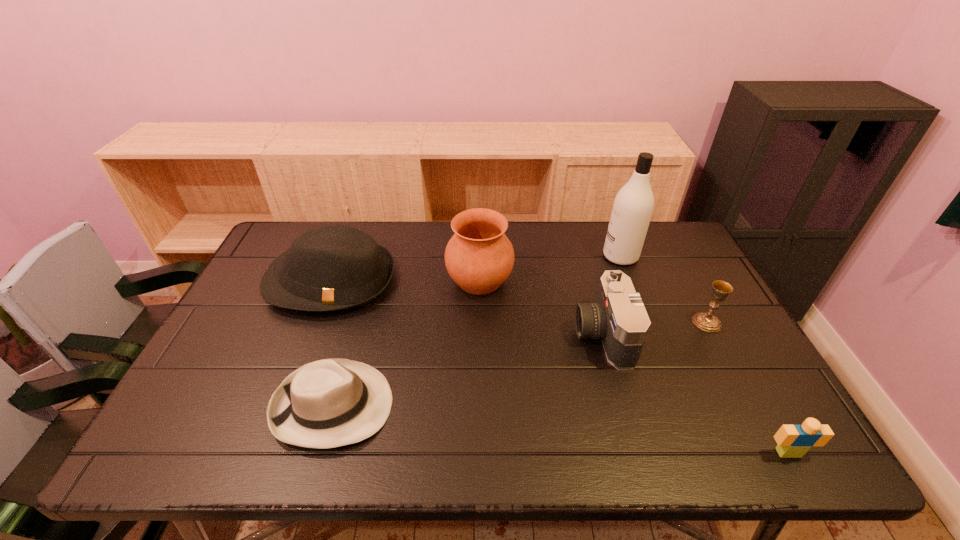
This screenshot has height=540, width=960. Find the location of `shampoo`. shampoo is located at coordinates (632, 209).

Image resolution: width=960 pixels, height=540 pixels. I want to click on the second tallest object, so click(479, 257).

Identify the location of pottery. This screenshot has width=960, height=540. (479, 257).

At what (x,y) coordinates should I click in order to perform the action: click on the farther fedora. Please return your answer as a coordinate pair (x, y). The height and width of the screenshot is (540, 960). Looking at the image, I should click on (336, 267).

This screenshot has height=540, width=960. Find the location of `camera`. camera is located at coordinates (619, 318).

Locate an element on the screen. This screenshot has width=960, height=540. chalice is located at coordinates (706, 321).

Locate an element on the screen. Lego is located at coordinates (794, 441).

The image size is (960, 540). What are the coordinates of `the nearer fedora` in the screenshot? It's located at (328, 403).

Locate an element on the screen. This screenshot has height=540, width=960. vacant space located on the front-facing side of the shampoo is located at coordinates (533, 256).

Identify the location of free space located 0.280m on the front-facing side of the shampoo. (518, 256).